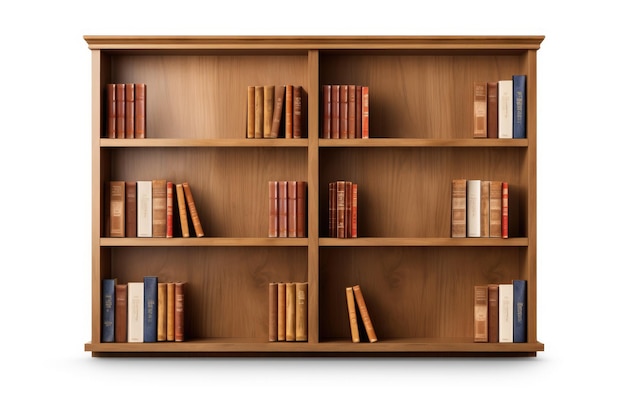
I want to click on books on upper right shelf, so click(491, 104), click(521, 116), click(506, 90), click(481, 126), click(336, 119), click(327, 106), click(344, 107), click(351, 119), click(357, 105), click(364, 95).